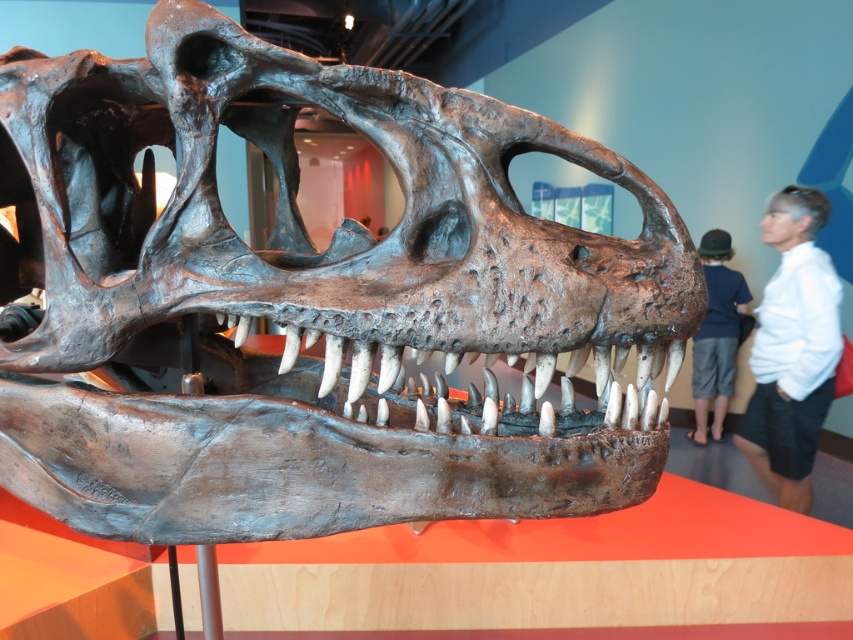
Can you confirm if rusty metallic skull at center is bigger than white matte shirt at upper right?

Indeed, rusty metallic skull at center has a larger size compared to white matte shirt at upper right.

Can you confirm if rusty metallic skull at center is smaller than white matte shirt at upper right?

No, rusty metallic skull at center is not smaller than white matte shirt at upper right.

Which is behind, point (148, 269) or point (815, 260)?

Point (815, 260)

Where is `rusty metallic skull at center`? The image size is (853, 640). rusty metallic skull at center is located at coordinates (311, 304).

Is white matte shirt at upper right taller than dark blue shirt at right?

Yes, white matte shirt at upper right is taller than dark blue shirt at right.

This screenshot has height=640, width=853. Describe the element at coordinates (792, 349) in the screenshot. I see `white matte shirt at upper right` at that location.

Identify the location of white matte shirt at upper right. Image resolution: width=853 pixels, height=640 pixels. (792, 349).

Is rusty metallic skull at center taller than dark blue shirt at right?

No.

Does rusty metallic skull at center come in front of dark blue shirt at right?

Yes, it is in front of dark blue shirt at right.

Find the location of a particular element. The height and width of the screenshot is (640, 853). rusty metallic skull at center is located at coordinates (311, 304).